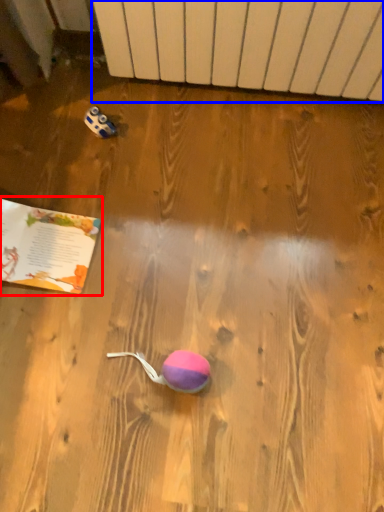
Question: Which object is closer to the camera taking this photo, book (highlighted by a red box) or radiator (highlighted by a blue box)?

Choices:
 (A) book
 (B) radiator

Answer: (B)